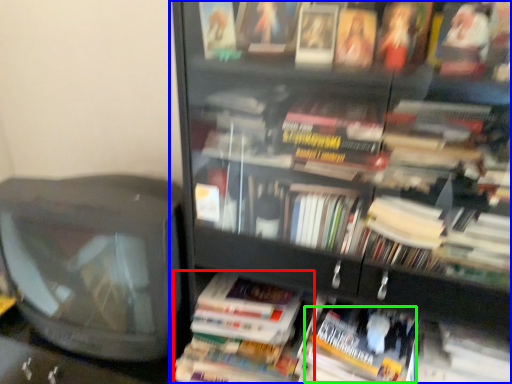
Question: Which object is positioned farthest from paperback book (highlighted by a red box)? Select from bookcase (highlighted by a blue box) and paperback book (highlighted by a green box).

Choices:
 (A) bookcase
 (B) paperback book

Answer: (A)